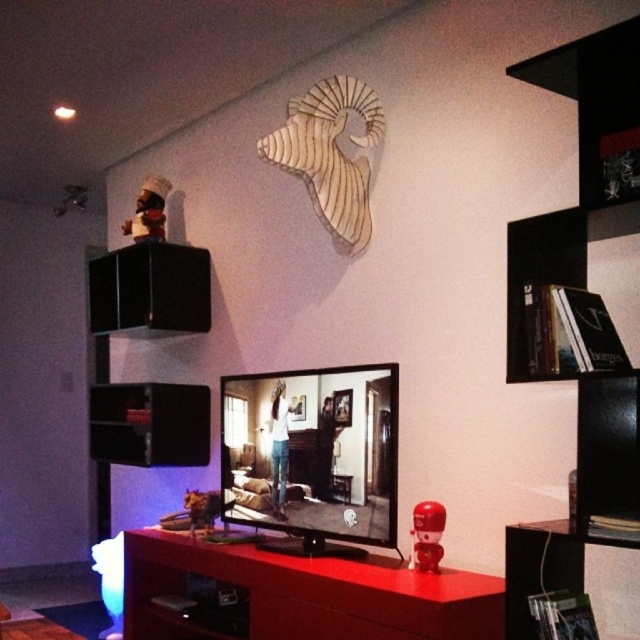
Is point (280, 476) positioned behind point (525, 564)?

Yes, it is behind point (525, 564).

You are a GUI agent. You are given a task and a screenshot of the screen. Output one action in this format:
    pyautogui.click(x=<x>, y=<y>)
    Task: Click on the smooth glossy tv at center
    The height and width of the screenshot is (640, 640).
    Given the screenshot: What is the action you would take?
    pyautogui.click(x=310, y=456)

This screenshot has width=640, height=640. What are the coordinates of `smooth glossy tv at center` in the screenshot? It's located at (310, 456).

Which is behind, point (246, 452) or point (412, 516)?

The point (246, 452) is behind.

The height and width of the screenshot is (640, 640). I want to click on smooth glossy tv at center, so click(310, 456).

Is point (328, 486) farther from camera compared to point (429, 566)?

That is True.

Where is `smooth glossy tv at center`? This screenshot has width=640, height=640. smooth glossy tv at center is located at coordinates (310, 456).

Who is lower down, matte red dresser at center or wooden picture frame at upper center?

matte red dresser at center is lower down.

Between point (273, 561) and point (333, 397), which one is positioned in front?

Positioned in front is point (273, 561).

Does point (176, 563) come farther from viewer compared to point (346, 413)?

Yes, point (176, 563) is behind point (346, 413).

Where is `matte red dresser at center`? This screenshot has width=640, height=640. matte red dresser at center is located at coordinates (307, 593).